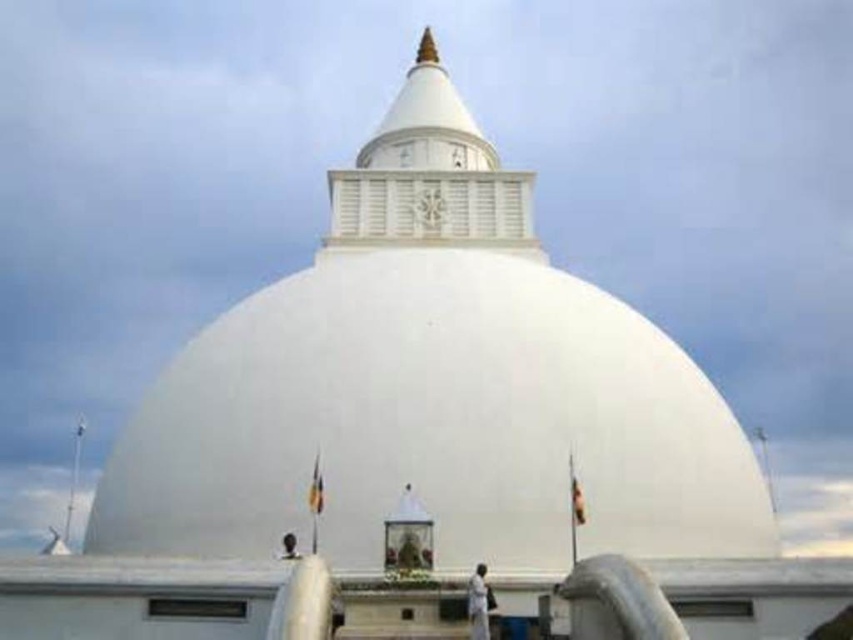
Question: From the image, what is the correct spatial relationship of white fabric person at lower center in relation to black matte person at center?

Choices:
 (A) below
 (B) above

Answer: (A)

Question: Which of these objects is positioned closest to the black matte person at center?

Choices:
 (A) white fabric person at lower center
 (B) white smooth dome at center

Answer: (A)

Question: Does white smooth dome at center have a greater width compared to black matte person at center?

Choices:
 (A) yes
 (B) no

Answer: (A)

Question: Which point is farther to the camera?

Choices:
 (A) (619, 300)
 (B) (286, 540)
 (C) (474, 634)

Answer: (A)

Question: Is white fabric person at lower center closer to camera compared to black matte person at center?

Choices:
 (A) yes
 (B) no

Answer: (A)

Question: Among these objects, which one is farthest from the camera?

Choices:
 (A) black matte person at center
 (B) white smooth dome at center

Answer: (B)